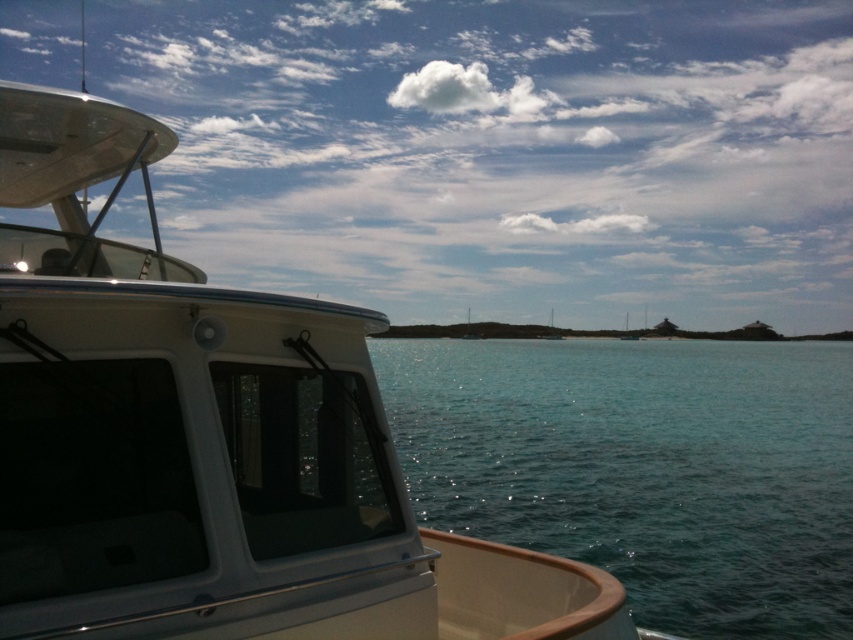
You are navigating a small kayak and want to dock near the white glossy boat at left. Given that your kayak is 2 meters long, can you safely approach and dock next to it without hitting the boat?

The white glossy boat at left is located at point (503, 152), but without knowing the exact dimensions or positioning relative to your kayak, it is difficult to determine if docking safely is possible. Consider checking the distance between your kayak and the boat before proceeding.

You are standing on the deck of the boat and want to move towards the clear blue water at center. Which direction should you walk relative to the white glossy boat at left?

Since the white glossy boat at left is to the left of the clear blue water at center, you should walk to the right of the white glossy boat at left to reach the clear blue water at center.

You are standing on the deck of the boat and looking out. Which object, the white glossy boat at left or the clear blue water at center, is positioned higher from your viewpoint?

The white glossy boat at left is positioned higher than the clear blue water at center from your viewpoint.